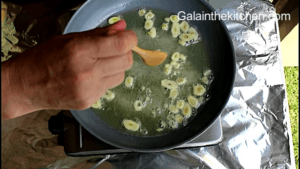
I want to click on black pan, so click(x=172, y=144).